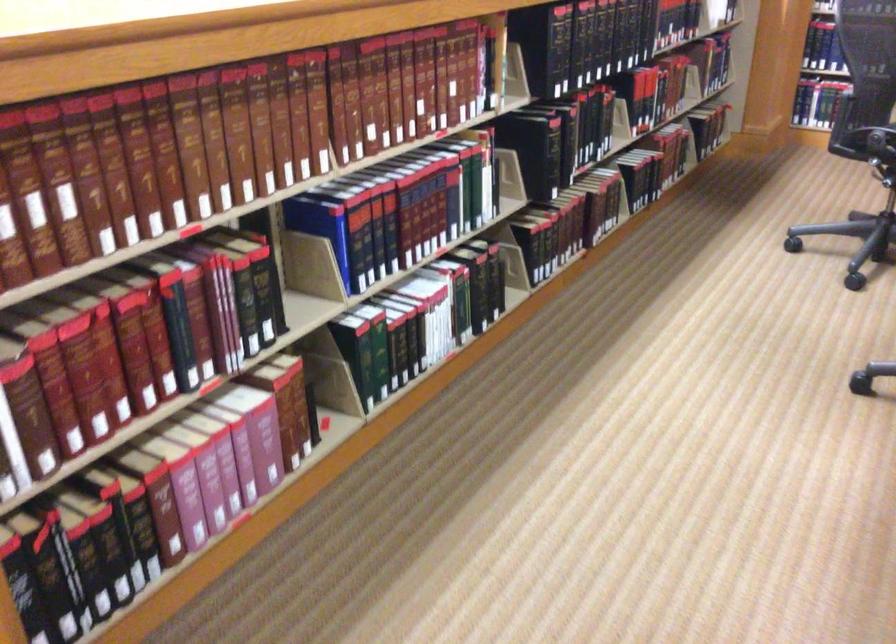
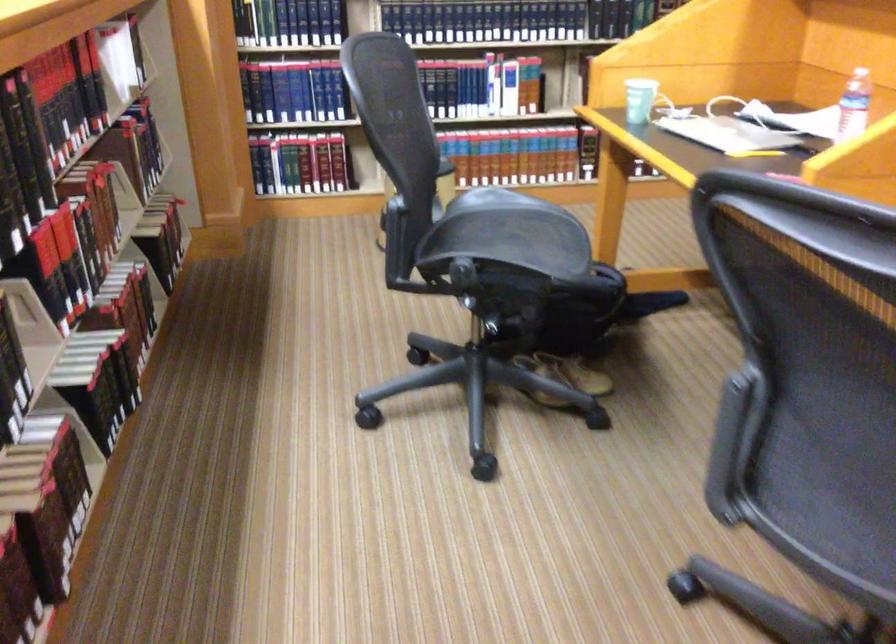
Question: I am providing you with two images of the same scene from different viewpoints. After the viewpoint changes to image2, which objects are now occluded?

Choices:
 (A) chair armrest
 (B) black fireplace tool
 (C) blue leather book
 (D) plastic water bottle

Answer: (C)